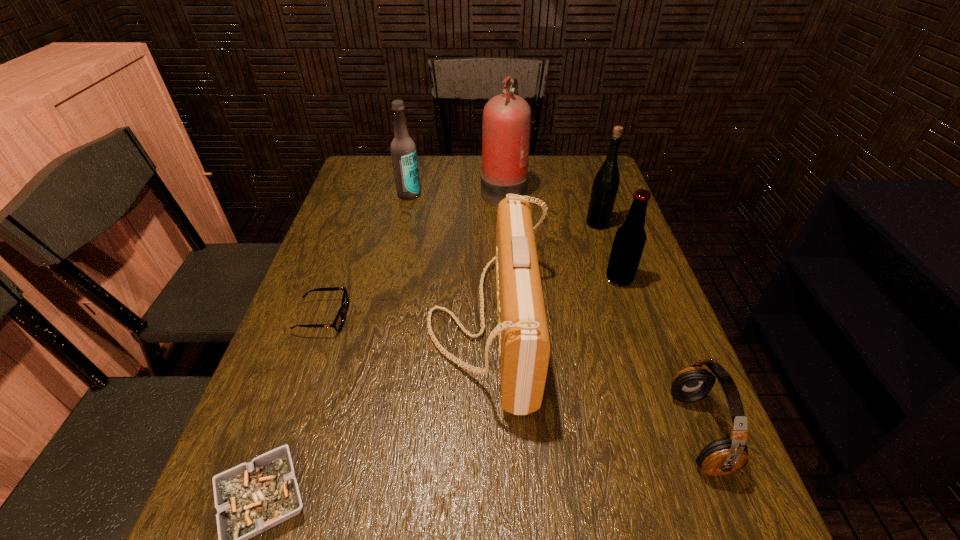
Locate an element on the screen. This screenshot has width=960, height=540. vacant region located 0.340m on the front-facing side of the sunglasses is located at coordinates (497, 318).

Where is `fire extinguisher located at the far edge`? Image resolution: width=960 pixels, height=540 pixels. fire extinguisher located at the far edge is located at coordinates (506, 125).

At what (x,y) coordinates should I click in order to perform the action: click on beer bottle at the far edge. Please return your answer as a coordinate pair (x, y). The height and width of the screenshot is (540, 960). Looking at the image, I should click on (403, 149).

Where is `object at the left edge`? The width and height of the screenshot is (960, 540). object at the left edge is located at coordinates (338, 323).

The image size is (960, 540). Identify the location of headset located at the right edge. (725, 456).

The width and height of the screenshot is (960, 540). What are the coordinates of `free space at the near edge of the desktop` in the screenshot? It's located at (566, 538).

In the image, there is a desktop. At what (x,y) coordinates should I click in order to perform the action: click on vacant space at the left edge. Please return your answer as a coordinate pair (x, y). Image resolution: width=960 pixels, height=540 pixels. Looking at the image, I should click on (342, 225).

Locate an element on the screen. This screenshot has height=540, width=960. blank space at the right edge of the desktop is located at coordinates (661, 331).

You are a GUI agent. You are given a task and a screenshot of the screen. Output one action in this format:
    pyautogui.click(x=<x>, y=<y>)
    Task: Click on the vacant space at the near left corner of the desktop
    Image resolution: width=960 pixels, height=540 pixels.
    Given the screenshot: What is the action you would take?
    pyautogui.click(x=215, y=536)

At what (x,y) coordinates should I click in order to perform the action: click on unoccupied position between the fire extinguisher and the shortest beer bottle. Please return your answer as a coordinate pair (x, y). The image size is (960, 540). Looking at the image, I should click on (562, 234).